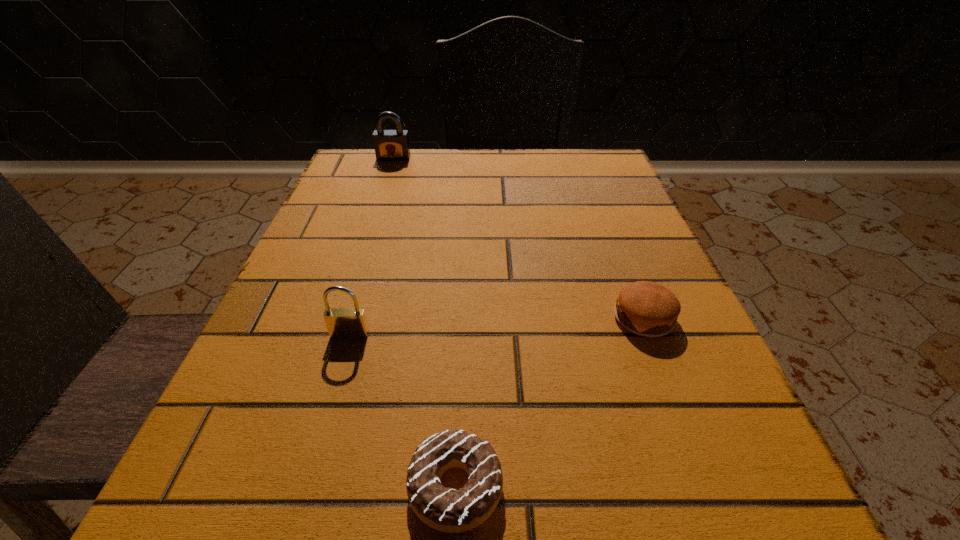
The image size is (960, 540). I want to click on the farthest object, so click(x=390, y=145).

Locate an element on the screen. This screenshot has height=540, width=960. the taller padlock is located at coordinates (390, 145).

Locate an element on the screen. the nearer padlock is located at coordinates (342, 323).

Locate an element on the screen. the third shortest object is located at coordinates (342, 323).

Find the location of a particular element. Image resolution: width=960 pixels, height=540 pixels. hamburger is located at coordinates (648, 309).

Identify the location of the rightmost object. This screenshot has height=540, width=960. (648, 309).

The height and width of the screenshot is (540, 960). What are the coordinates of `the third object from left to right` in the screenshot? It's located at (448, 510).

The height and width of the screenshot is (540, 960). I want to click on the shortest object, so click(448, 510).

The image size is (960, 540). I want to click on vacant space situated on the front of the tallest object near the keyhole, so click(373, 219).

You are a GUI agent. You are given a task and a screenshot of the screen. Output one action in this format:
    pyautogui.click(x=<x>, y=<y>)
    Task: Click on the vacant space located 0.210m on the front-facing side of the shorter padlock
    This screenshot has height=540, width=960.
    Given the screenshot: What is the action you would take?
    pyautogui.click(x=305, y=484)